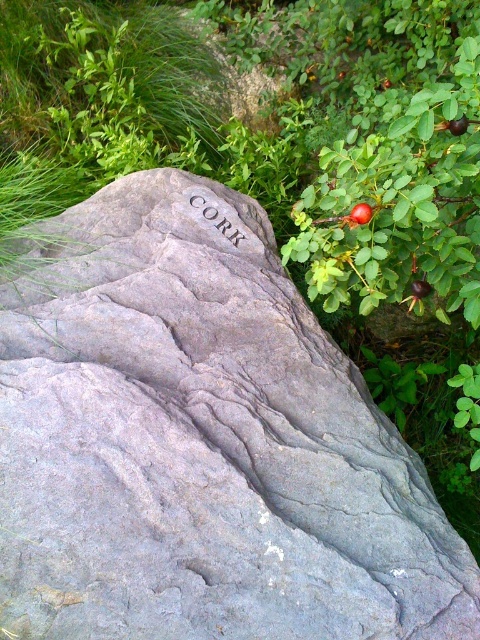
Who is more distant from viewer, (364,209) or (451,120)?

Positioned behind is point (364,209).

Is point (350, 224) positioned behind point (460, 116)?

Yes, it is.

Locate an element on the screen. Image resolution: width=480 pixels, height=640 pixels. glossy red rosehip at upper right is located at coordinates (360, 214).

Between gray stone engraving at center and shiny brown rosehip at upper right, which one is positioned higher?

gray stone engraving at center is higher up.

At what (x,y) coordinates should I click in order to perform the action: click on gray stone engraving at center. Please return your answer as a coordinate pair (x, y). The height and width of the screenshot is (640, 480). Looking at the image, I should click on (216, 218).

Can you confirm if gray rock at center is taller than gray stone engraving at center?

Yes, gray rock at center is taller than gray stone engraving at center.

Who is shorter, gray rock at center or gray stone engraving at center?

gray stone engraving at center

Where is `gray rock at center`? This screenshot has height=640, width=480. gray rock at center is located at coordinates (202, 444).